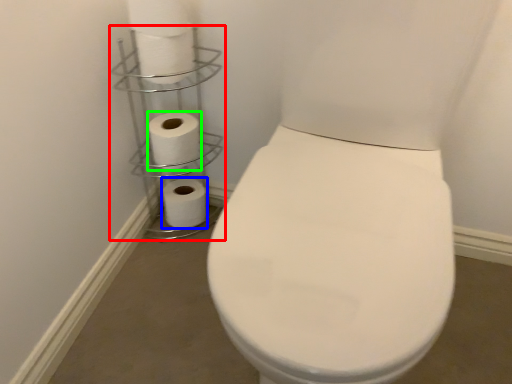
Question: Based on their relative distances, which object is nearer to shelf (highlighted by a red box)? Choose from toilet paper (highlighted by a blue box) and toilet paper (highlighted by a green box).

Choices:
 (A) toilet paper
 (B) toilet paper

Answer: (B)